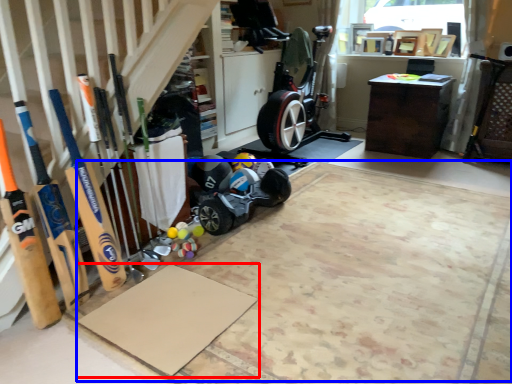
Question: Which point is closer to the camera, yoga mat (highlighted by a red box) or yoga mat (highlighted by a blue box)?

Choices:
 (A) yoga mat
 (B) yoga mat

Answer: (B)